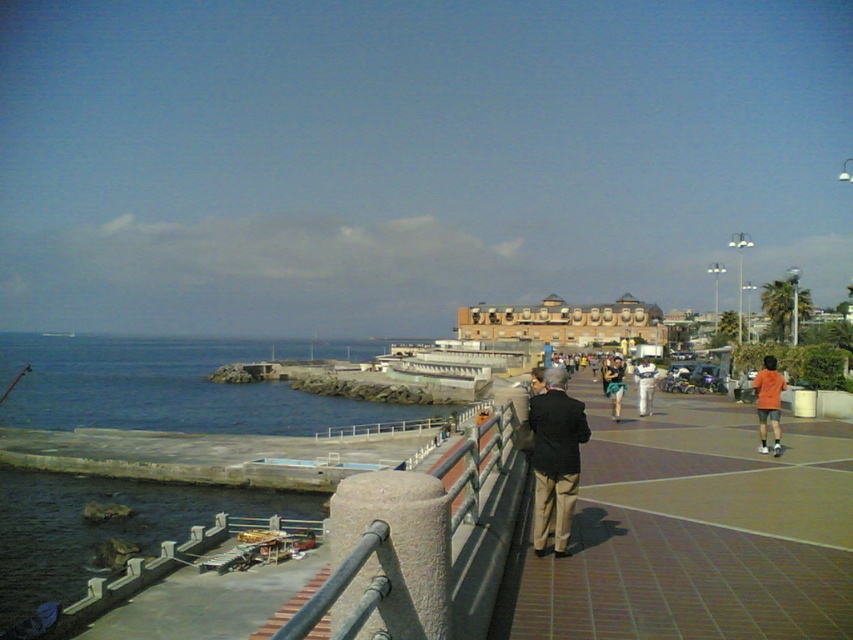
You are standing on the coastal promenade and want to take a photo of the white cotton shirt at center without including the brown brick sidewalk at center in the frame. How can you adjust your position to achieve this?

Since the brown brick sidewalk at center is closer to the viewer than the white cotton shirt at center, you can move your position further back to create distance between yourself and the sidewalk, allowing the shirt to be framed without the sidewalk obstructing the view.

You are standing on the coastal promenade and want to take a photo of the brown brick sidewalk at center and the white cotton shirt at center. Which object should you zoom in more on to ensure both are clearly visible in the frame?

You should zoom in more on the brown brick sidewalk at center because it has a smaller size compared to the white cotton shirt at center, ensuring both fit clearly in the frame.